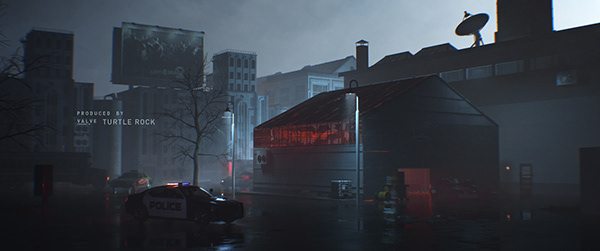
Where is `dish`? The image size is (600, 251). dish is located at coordinates [479, 24].